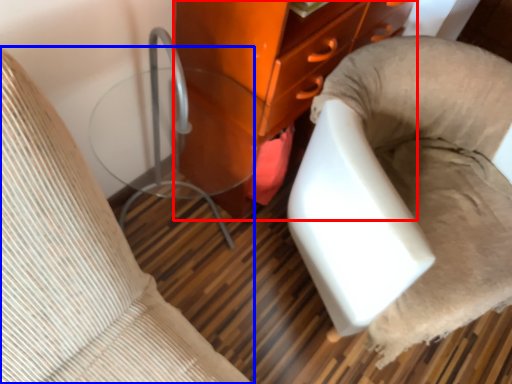
Question: Which point is further to the camera, furniture (highlighted by a red box) or furniture (highlighted by a blue box)?

Choices:
 (A) furniture
 (B) furniture

Answer: (A)